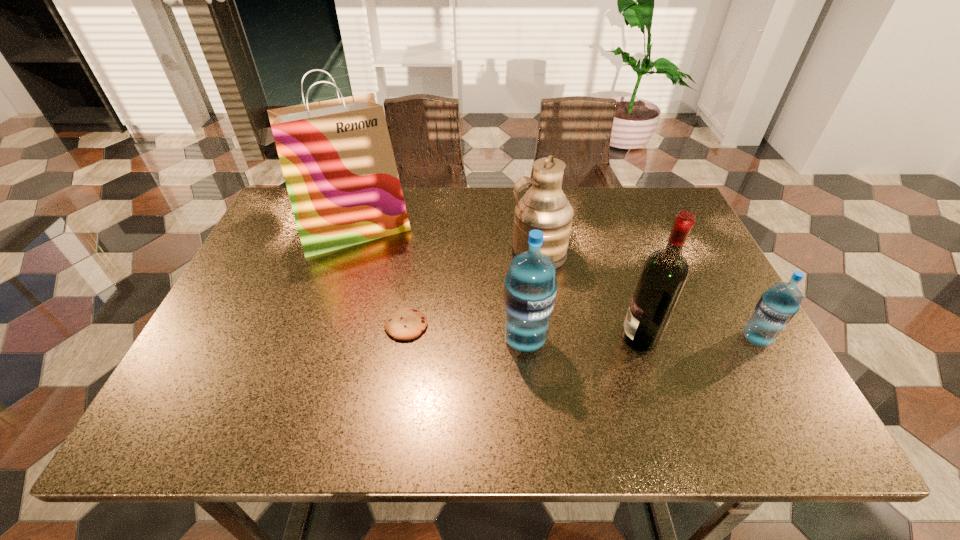
The height and width of the screenshot is (540, 960). Identify the location of vacant area located on the left of the shortest object. (215, 326).

Image resolution: width=960 pixels, height=540 pixels. Find the location of `vacant area located on the back of the pitcher`. vacant area located on the back of the pitcher is located at coordinates (534, 226).

Locate an element on the screen. The height and width of the screenshot is (540, 960). vacant space located on the front and back of the second object from right to left is located at coordinates (599, 338).

This screenshot has height=540, width=960. I want to click on vacant area situated 0.240m on the front and back of the second object from right to left, so click(514, 338).

Where is `vacant region located 0.350m on the front and back of the second object from right to left`? The height and width of the screenshot is (540, 960). vacant region located 0.350m on the front and back of the second object from right to left is located at coordinates (465, 338).

Identify the location of object present at the far edge. (336, 155).

Identify the location of object at the near edge. (530, 288).

Locate an element on the screen. Image resolution: width=960 pixels, height=540 pixels. object situated at the left edge is located at coordinates (336, 155).

Where is `object that is at the right edge`? The width and height of the screenshot is (960, 540). object that is at the right edge is located at coordinates (776, 308).

The height and width of the screenshot is (540, 960). In order to click on object at the far left corner in this screenshot , I will do `click(336, 155)`.